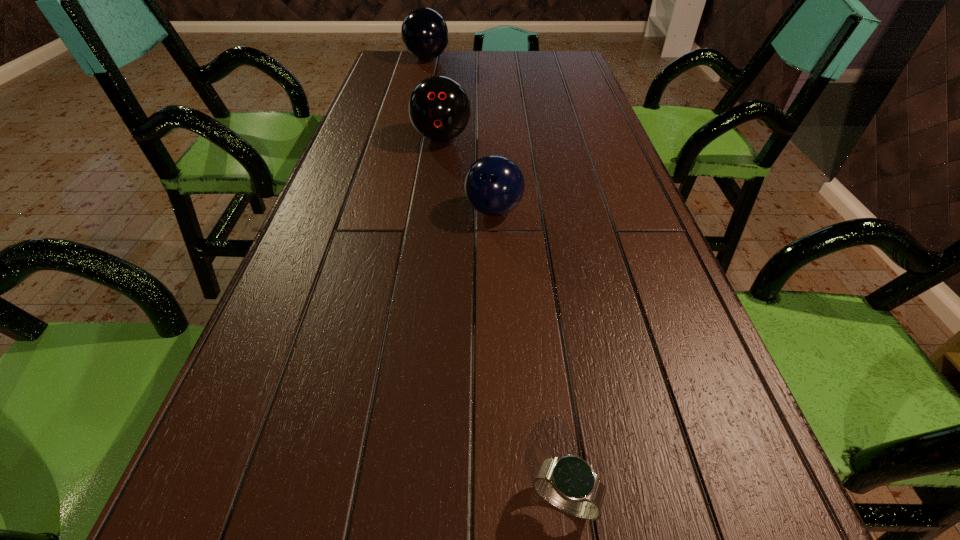
Where is `free region that satisfies the following two spatial constraints: 1. on the side of the nearest object with the finger holes; 2. on the right side of the farthest bowling ball`? free region that satisfies the following two spatial constraints: 1. on the side of the nearest object with the finger holes; 2. on the right side of the farthest bowling ball is located at coordinates (322, 502).

Find the location of a particular element. free space that satisfies the following two spatial constraints: 1. on the surface of the shortest object near the finger holes; 2. on the left side of the shortest bowling ball is located at coordinates (504, 502).

Where is `vacant region that satisfies the following two spatial constraints: 1. on the surface of the shortest object near the finger holes; 2. on the right side of the nearest bowling ball`? vacant region that satisfies the following two spatial constraints: 1. on the surface of the shortest object near the finger holes; 2. on the right side of the nearest bowling ball is located at coordinates (504, 502).